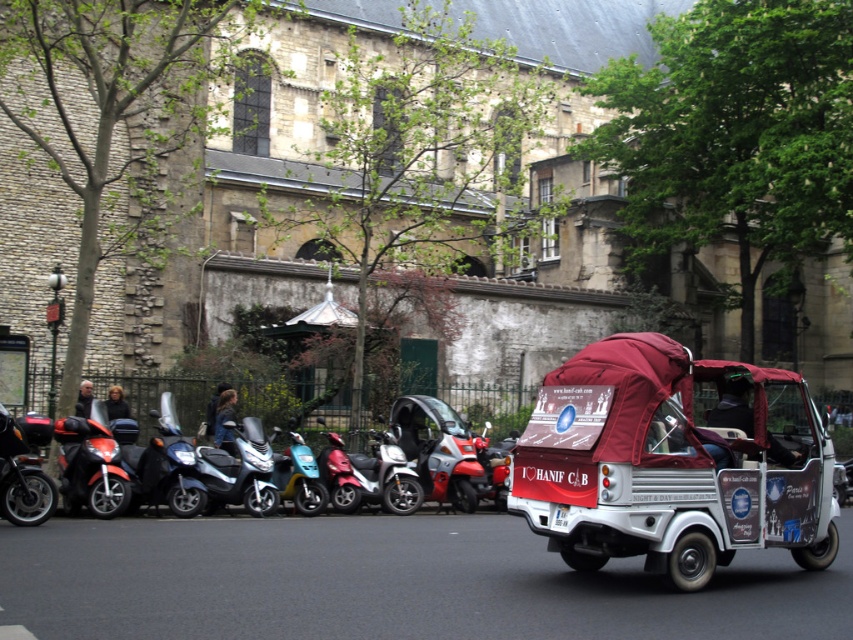
You are a delivery person who needs to load a large package onto the metallic silver tricycle at center right and the metallic blue scooter at center. Based on their heights, which vehicle can accommodate the package without needing to adjust its height?

The metallic blue scooter at center can accommodate the package without needing to adjust its height because the metallic silver tricycle at center right has a lesser height compared to it.

You are a delivery person who needs to park your scooter between two other scooters. You have a scooter that is 1.2 meters wide. The metallic silver scooter at center and the metallic blue scooter at center are parked next to each other. Can your scooter fit in the space between them?

The metallic silver scooter at center is wider than the metallic blue scooter at center. However, without knowing the exact distance between them, it is impossible to determine if your 1.2 meter wide scooter can fit in the space between them.

Consider the image. You are a delivery person who needs to park your vehicle in a small parking spot. You have to choose between the metallic silver tricycle at center right and the metallic blue scooter at center. Which vehicle should you choose to ensure it fits in the parking spot?

The metallic silver tricycle at center right occupies less space than the metallic blue scooter at center, so you should choose the metallic silver tricycle at center right to ensure it fits in the parking spot.